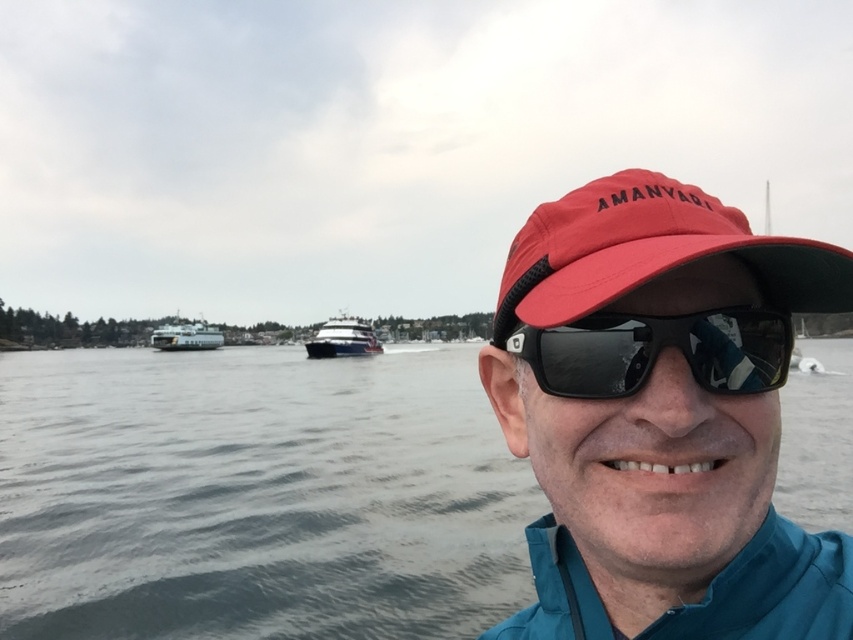
You are a photographer trying to capture the perfect shot of the person in the scene. Since you want to focus on their accessories, you need to know the position of the matte red cap at center and the black reflective sunglasses at center. Which accessory is positioned to the left?

The matte red cap at center is to the left of black reflective sunglasses at center, so the matte red cap at center is positioned to the left.

You are a photographer trying to capture the scene where the matte red cap at center and gray water at center are both visible. Based on their positions, which object would you focus on first to ensure both are in frame?

The matte red cap at center is above the gray water at center, so focusing on the matte red cap at center first would allow the photographer to frame the shot so both objects are included.